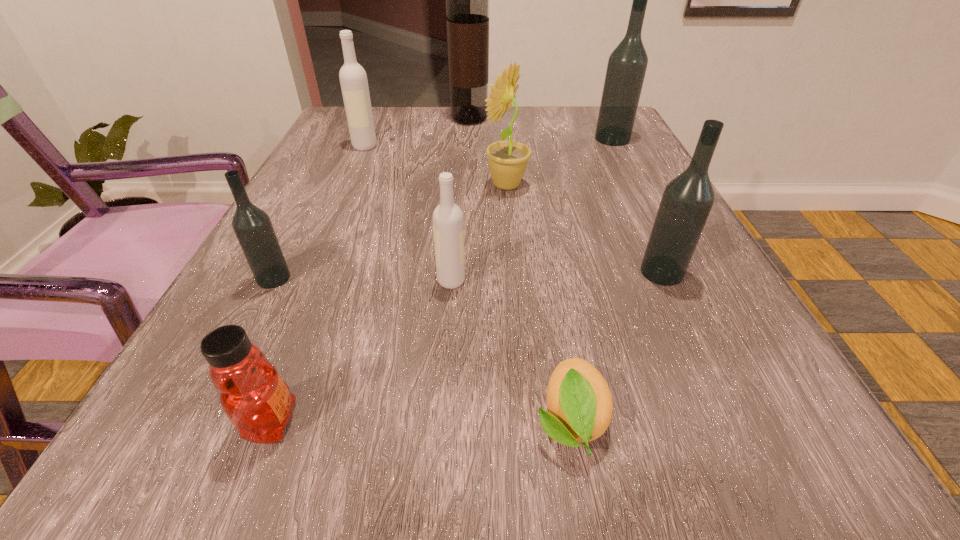
The width and height of the screenshot is (960, 540). I want to click on vodka identified as the fourth closest to the yellow sunflower, so click(353, 79).

Select which black vodka is the closest to the second smallest black vodka. Please provide its 2D coordinates. Your answer should be formatted as a tuple, i.e. [(x, y)], where the tuple contains the x and y coordinates of a point satisfying the conditions above.

[(627, 64)]

Locate an element on the screen. black vodka that is the closest one to the tallest object is located at coordinates pyautogui.click(x=627, y=64).

The height and width of the screenshot is (540, 960). In order to click on vacant space that satisfies the following two spatial constraints: 1. on the back side of the leftmost black vodka; 2. on the left side of the fourth vodka from right to left in this screenshot , I will do `click(342, 146)`.

The height and width of the screenshot is (540, 960). I want to click on vacant area in the image that satisfies the following two spatial constraints: 1. on the front side of the tallest vodka; 2. on the front label of the second shortest object, so point(756,421).